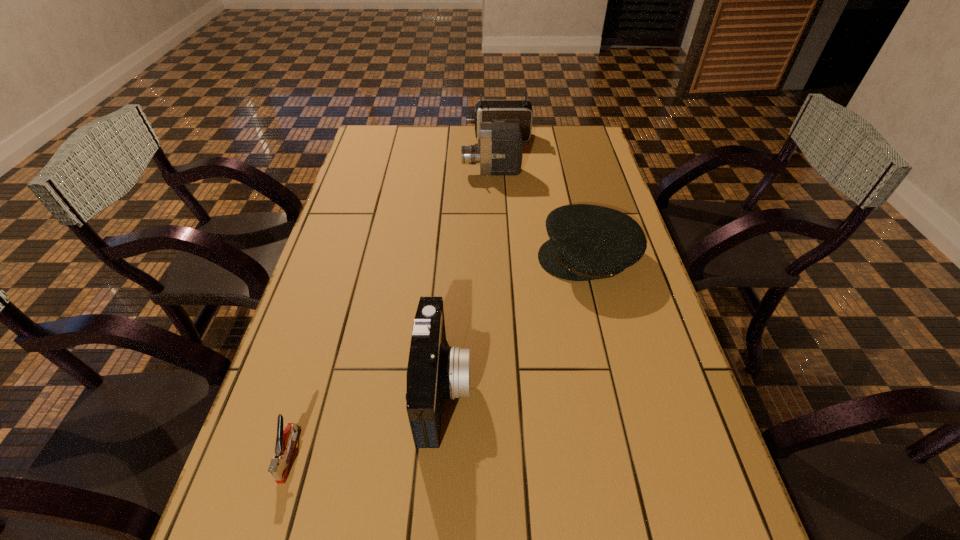
Find the location of a particular element. This screenshot has height=540, width=960. object that is positioned at the right edge is located at coordinates (587, 242).

Find the location of a particular element. The width and height of the screenshot is (960, 540). free spot at the far edge of the desktop is located at coordinates (448, 143).

Identify the location of vacant space at the left edge of the desktop. This screenshot has height=540, width=960. (324, 273).

You are a GUI agent. You are given a task and a screenshot of the screen. Output one action in this format:
    pyautogui.click(x=<x>, y=<y>)
    Task: Click on the vacant space at the right edge of the desktop
    The height and width of the screenshot is (540, 960).
    Given the screenshot: What is the action you would take?
    pyautogui.click(x=614, y=206)

This screenshot has width=960, height=540. I want to click on vacant space at the far left corner of the desktop, so click(371, 145).

You are a GUI agent. You are given a task and a screenshot of the screen. Output one action in this format:
    pyautogui.click(x=<x>, y=<y>)
    Task: Click on the free area in between the stapler and the second farthest object
    
    Given the screenshot: What is the action you would take?
    pyautogui.click(x=391, y=313)

Find the location of a particular element. Image resolution: width=960 pixels, height=540 pixels. vacant area that lies between the shortest object and the nearest camcorder is located at coordinates (367, 421).

I want to click on empty space that is in between the farthest camcorder and the nearest camcorder, so click(470, 263).

The width and height of the screenshot is (960, 540). Find the location of `blank region between the farthest object and the shortest object`. blank region between the farthest object and the shortest object is located at coordinates (394, 296).

The height and width of the screenshot is (540, 960). Identify the location of free spot between the nearest camcorder and the second nearest camcorder. (468, 280).